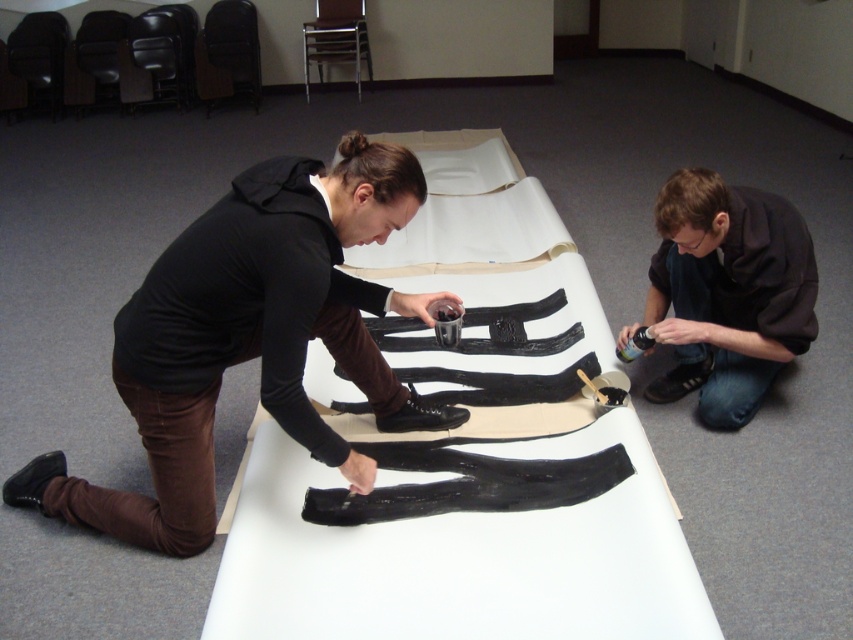
You are a photographer trying to capture the scene where two people are working on a project. You need to ensure the white paper at center is visible in the photo. Should you adjust your camera angle to avoid the black matte shirt at lower right blocking it?

The white paper at center is positioned under the black matte shirt at lower right, so adjusting the camera angle upward would help ensure the white paper at center remains visible without obstruction from the black matte shirt at lower right.

You are an artist trying to determine the placement of a new element in your artwork. Given the scene described, which object, the white paper at center or the matte black shoes at center, would allow you to add a taller element without overlapping?

The white paper at center has a greater height compared to the matte black shoes at center, so you can add a taller element on the white paper at center without overlapping.